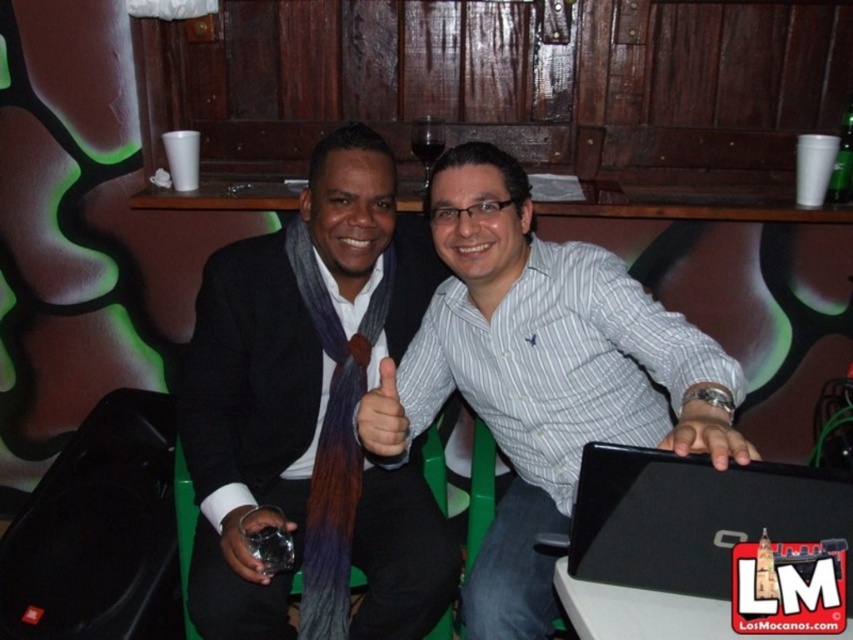
Does matte black suit at center lie in front of matte black glass at center?

No, matte black suit at center is behind matte black glass at center.

Between point (258, 394) and point (236, 518), which one is positioned behind?

The point (258, 394) is behind.

The height and width of the screenshot is (640, 853). Identify the location of matte black suit at center. (312, 410).

Does purple woolen tie at center have a greater width compared to matte brown tie at center?

Yes, purple woolen tie at center is wider than matte brown tie at center.

Find the location of a particular element. purple woolen tie at center is located at coordinates (334, 492).

At what (x,y) coordinates should I click in order to perform the action: click on purple woolen tie at center. Please return your answer as a coordinate pair (x, y). Image resolution: width=853 pixels, height=640 pixels. Looking at the image, I should click on (334, 492).

Can you confirm if black matte laptop at center is positioned above smooth skin hand at center?

No, black matte laptop at center is not above smooth skin hand at center.

Looking at this image, does black matte laptop at center have a greater width compared to smooth skin hand at center?

Yes.

Where is `black matte laptop at center`? Image resolution: width=853 pixels, height=640 pixels. black matte laptop at center is located at coordinates (694, 516).